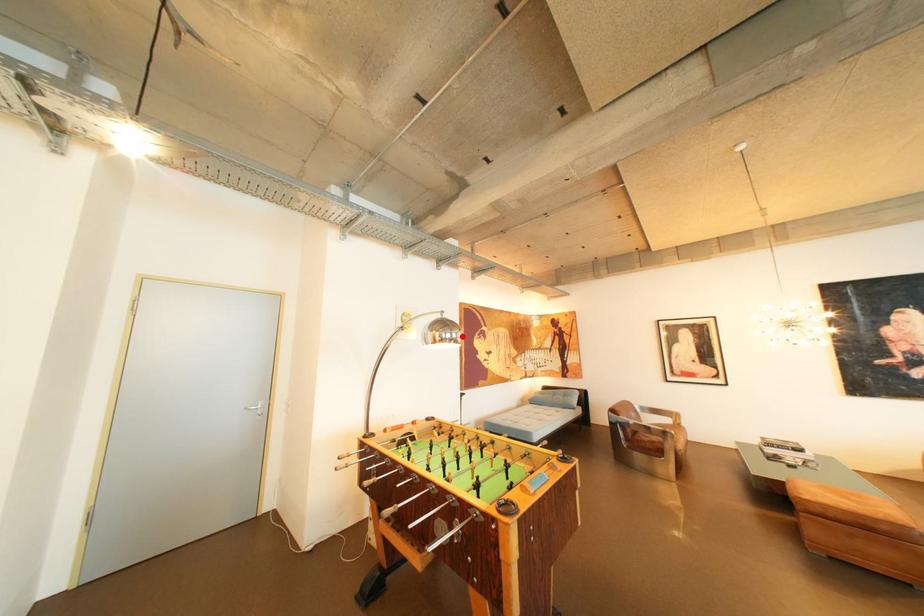
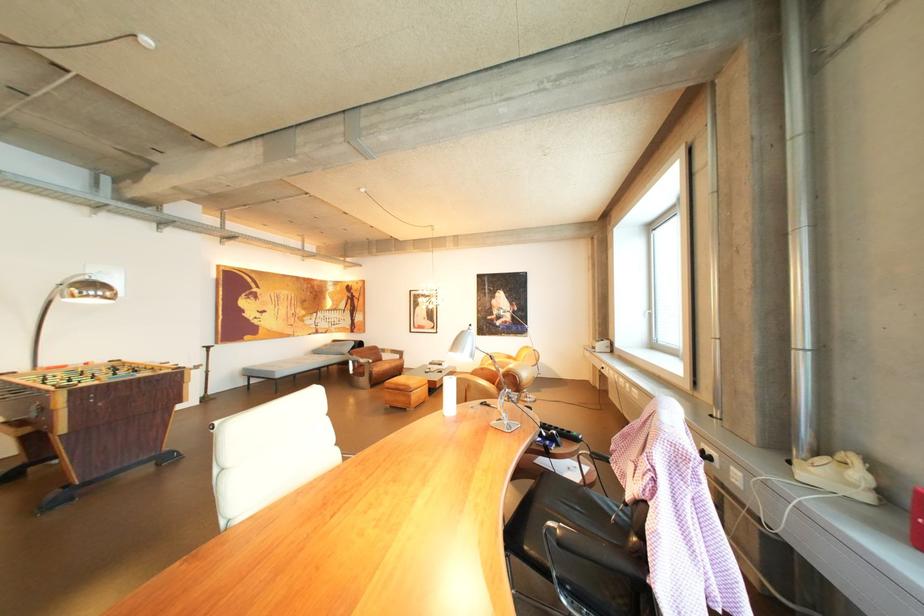
Find the pixel in the second image that matches the highlighted location in the first image.

(105, 294)